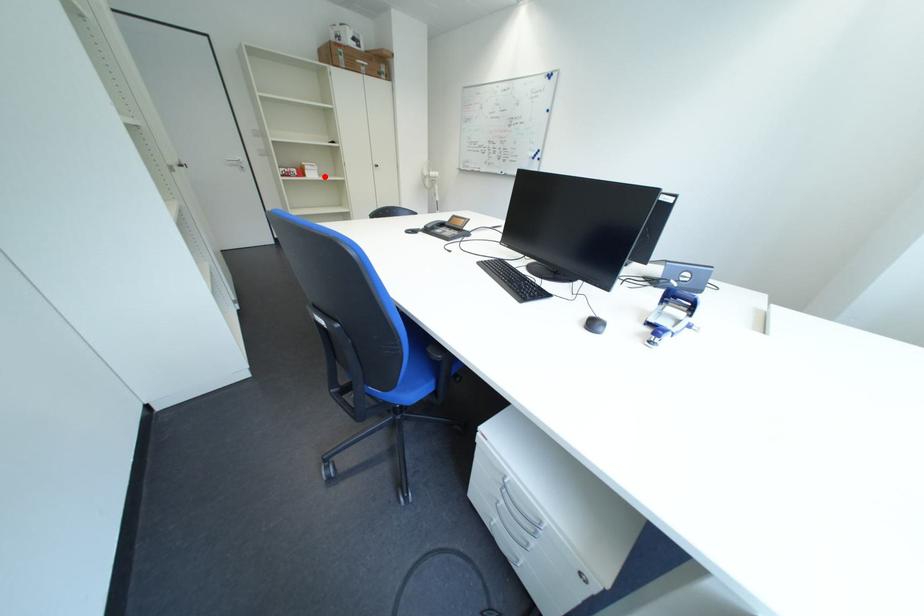
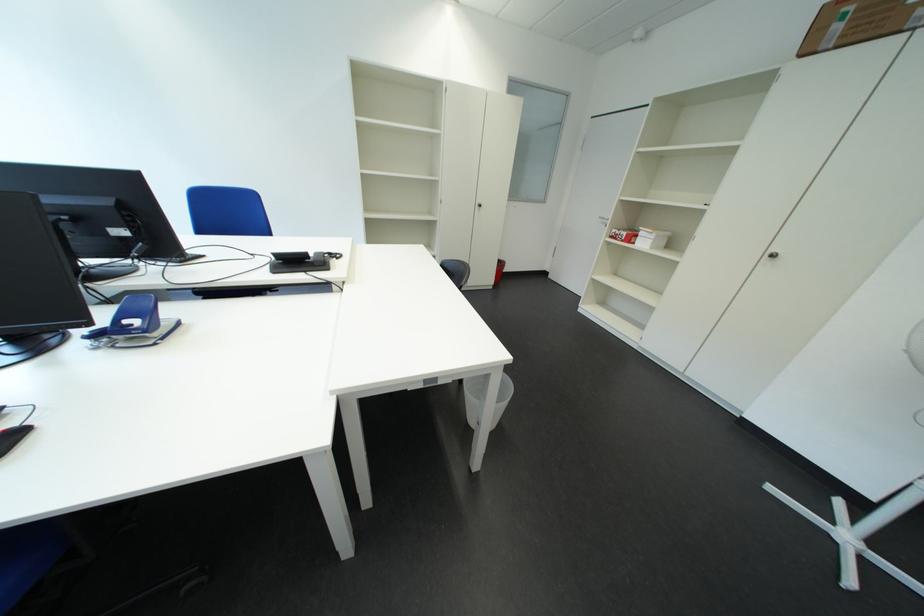
Find the pixel in the second image that matches the highlighted location in the first image.

(657, 246)